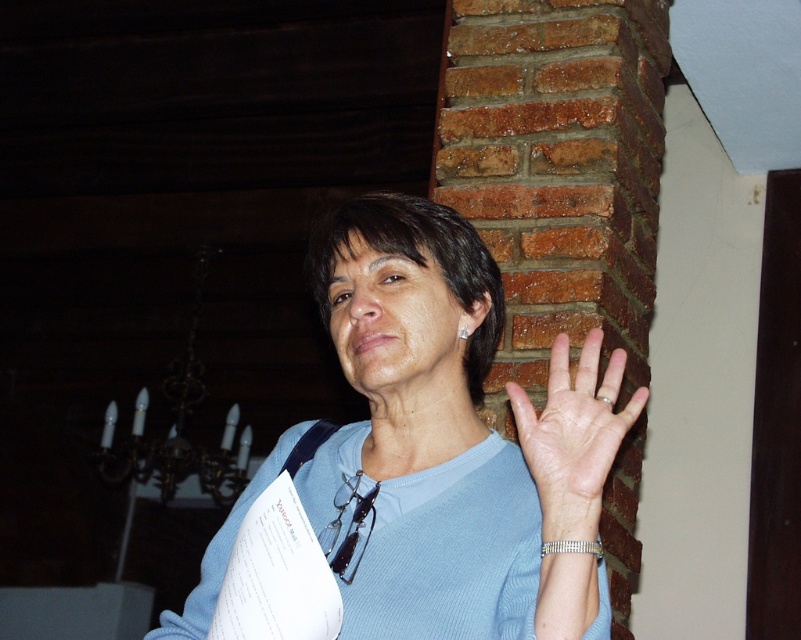
Question: Does blue fabric shirt at center appear over pale skin palm at center?

Choices:
 (A) no
 (B) yes

Answer: (B)

Question: Which point is farther from the camera taking this photo?

Choices:
 (A) (361, 499)
 (B) (526, 410)

Answer: (A)

Question: Can you confirm if blue fabric shirt at center is thinner than pale skin palm at center?

Choices:
 (A) yes
 (B) no

Answer: (B)

Question: Does blue fabric shirt at center appear on the left side of pale skin palm at center?

Choices:
 (A) no
 (B) yes

Answer: (B)

Question: Which object appears farthest from the camera in this image?

Choices:
 (A) blue fabric shirt at center
 (B) pale skin palm at center

Answer: (B)